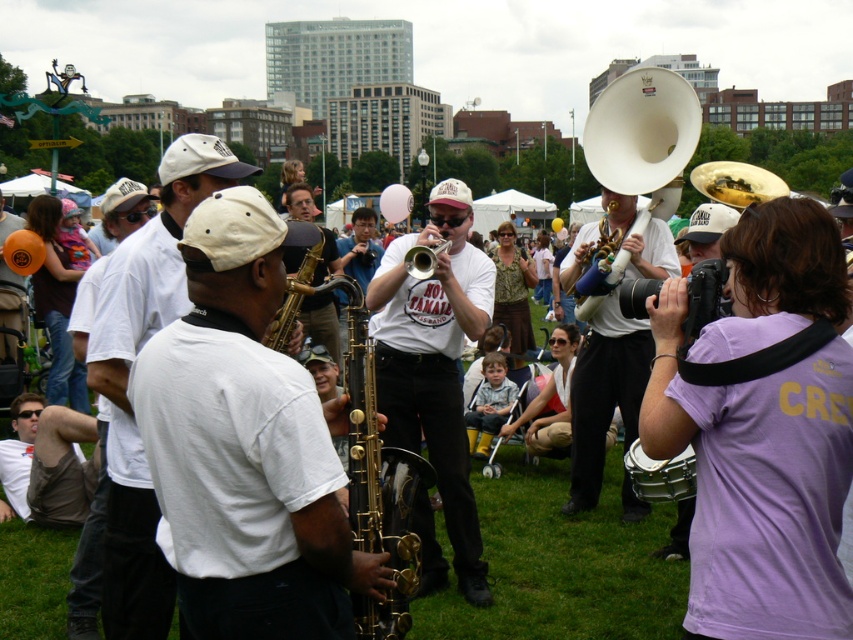
Question: Which point is farther to the camera?

Choices:
 (A) white matte saxophone at center
 (B) matte gold tuba at center
 (C) brushed brass trumpet at center
 (D) shiny brass tuba at center

Answer: (D)

Question: Which point is closer to the camera?

Choices:
 (A) (440, 248)
 (B) (577, 305)
 (C) (190, 570)
 (D) (383, 275)

Answer: (C)

Question: Which object appears closest to the camera in this image?

Choices:
 (A) gold shiny saxophone at center
 (B) white matte saxophone at center
 (C) brushed brass trumpet at center

Answer: (B)

Question: Can you confirm if gold shiny saxophone at center is positioned to the right of brushed brass trumpet at center?

Choices:
 (A) yes
 (B) no

Answer: (B)

Question: Can you confirm if metallic silver drum at lower right is positioned below shiny brass tuba at center?

Choices:
 (A) no
 (B) yes

Answer: (B)

Question: Can you confirm if white matte baseball cap at center is smaller than gold shiny saxophone at center?

Choices:
 (A) yes
 (B) no

Answer: (A)